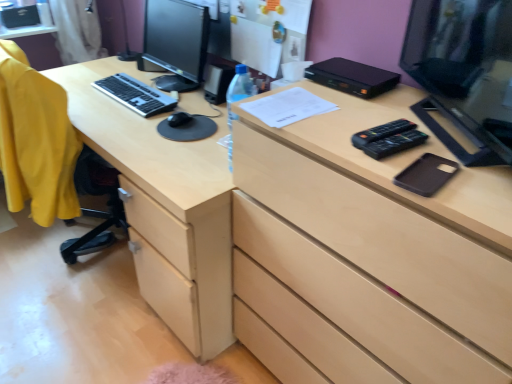
The width and height of the screenshot is (512, 384). I want to click on free space to the left of black glossy monitor at upper right, the second computer monitor positioned from the back, so click(x=366, y=119).